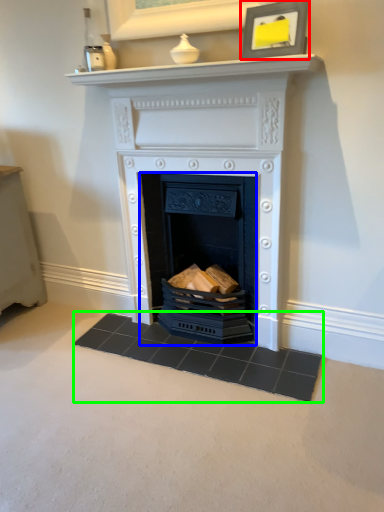
Question: Which object is positioned farthest from picture frame (highlighted by a red box)? Select from fireplace (highlighted by a blue box) and doormat (highlighted by a green box).

Choices:
 (A) fireplace
 (B) doormat

Answer: (B)